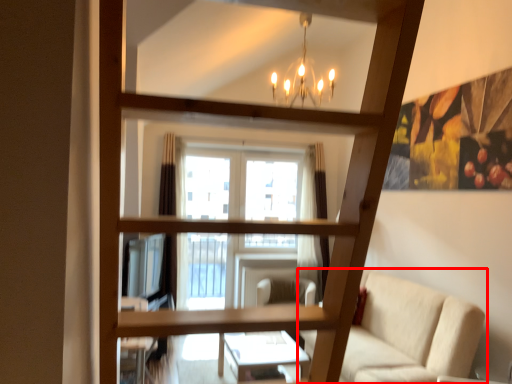
Question: Where is studio couch (annotated by the red box) located in relation to swivel chair in the image?

Choices:
 (A) right
 (B) left

Answer: (A)